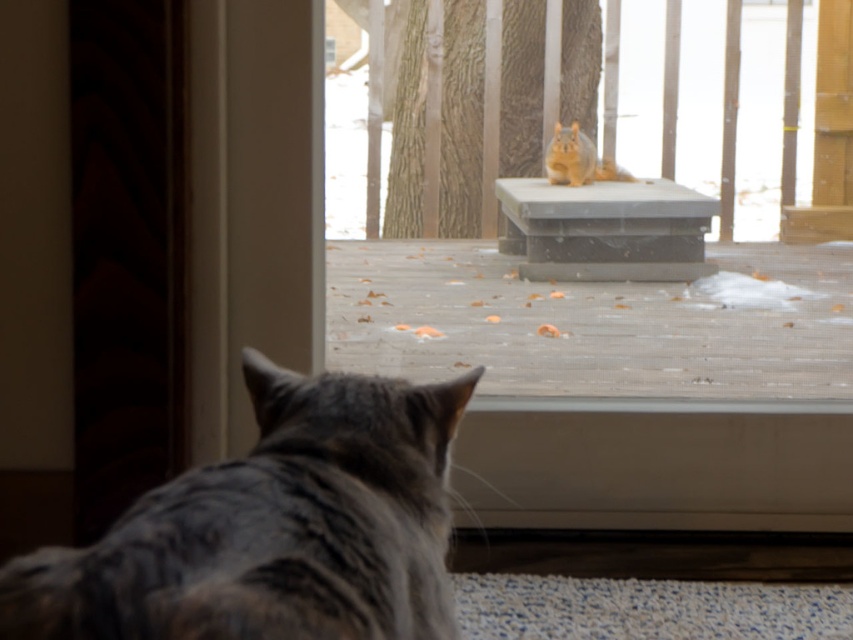
Question: Is gray fur cat at lower left above blonde fur squirrel at upper center?

Choices:
 (A) yes
 (B) no

Answer: (B)

Question: Considering the relative positions of gray fur cat at lower left and blonde fur squirrel at upper center in the image provided, where is gray fur cat at lower left located with respect to blonde fur squirrel at upper center?

Choices:
 (A) right
 (B) left

Answer: (B)

Question: Which object appears farthest from the camera in this image?

Choices:
 (A) gray fur cat at lower left
 (B) blonde fur squirrel at upper center

Answer: (B)

Question: Is gray fur cat at lower left thinner than blonde fur squirrel at upper center?

Choices:
 (A) no
 (B) yes

Answer: (A)